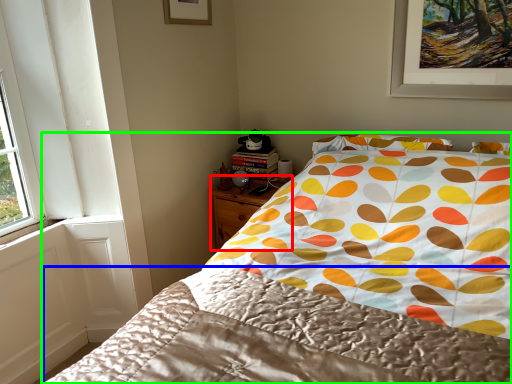
Question: Which object is the farthest from nightstand (highlighted by a red box)? Choose among these: blanket (highlighted by a blue box) or bed (highlighted by a green box).

Choices:
 (A) blanket
 (B) bed

Answer: (A)